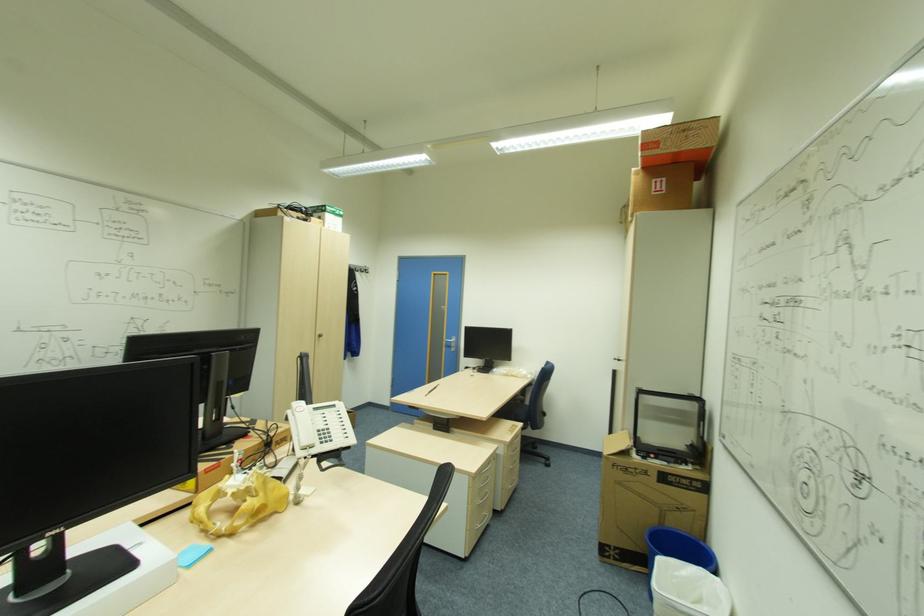
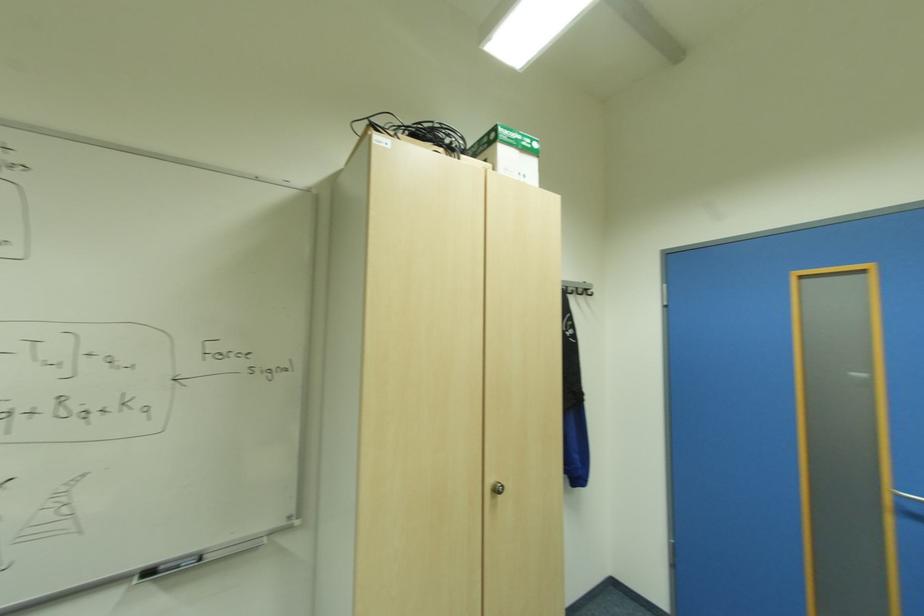
Where in the second image is the point corresponding to (x=342, y=211) from the first image?

(533, 140)